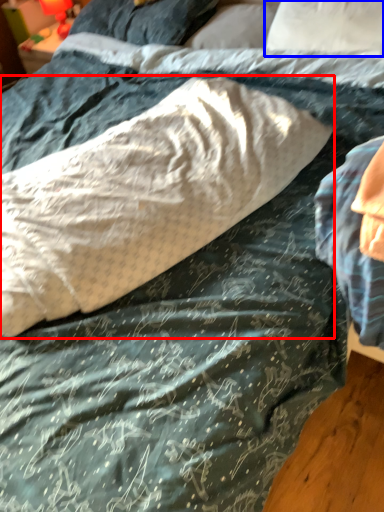
Question: Among these objects, which one is farthest to the camera, pillow (highlighted by a red box) or pillow (highlighted by a blue box)?

Choices:
 (A) pillow
 (B) pillow

Answer: (B)